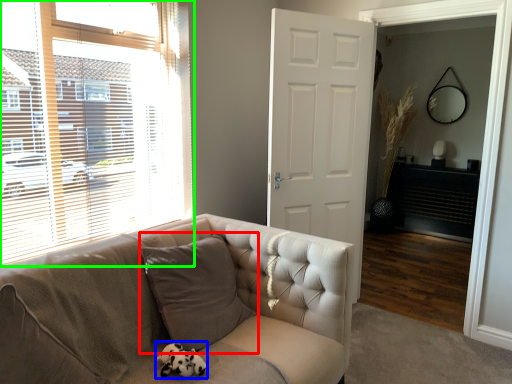
Question: Which object is positioned closest to pillow (highlighted by a red box)? Select from animal (highlighted by a blue box) and window (highlighted by a green box).

Choices:
 (A) animal
 (B) window

Answer: (A)